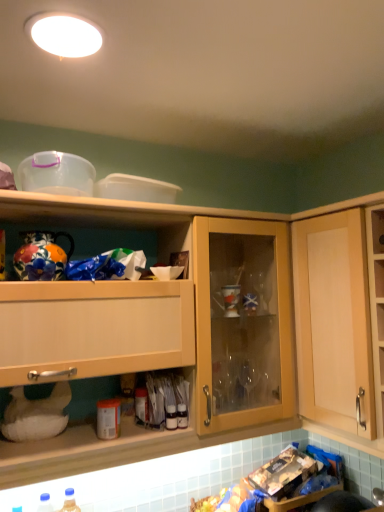
You are a GUI agent. You are given a task and a screenshot of the screen. Output one action in this format:
    pyautogui.click(x=<x>, y=<y>)
    Task: Click on the free space above white glossy light fixture at upper center (from a real-world perspective)
    
    Given the screenshot: What is the action you would take?
    click(71, 20)